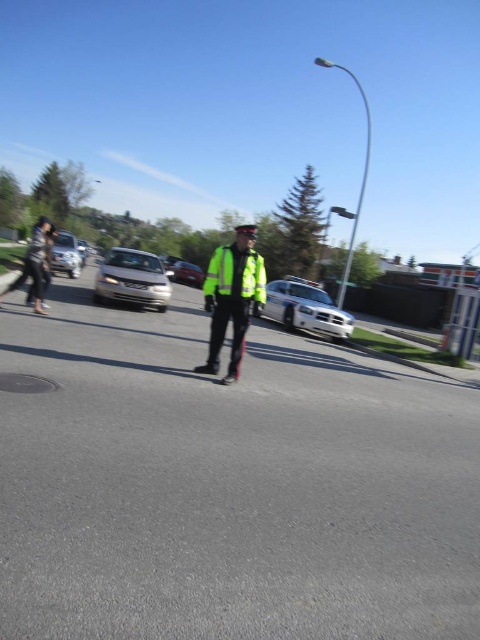
Question: Which point appears farthest from the camera in this image?

Choices:
 (A) (282, 294)
 (B) (68, 256)

Answer: (B)

Question: Can you confirm if satin silver sedan at center is positioned below silver metallic sedan at left?

Choices:
 (A) yes
 (B) no

Answer: (B)

Question: Estimate the real-world distances between objects in this image. Which object is farther from the white glossy police car at center?

Choices:
 (A) high visibility reflective jacket at center
 (B) shiny silver sedan at center
 (C) high-visibility reflective safety vest at center

Answer: (B)

Question: Does silver metallic sedan at left appear on the left side of shiny silver sedan at center?

Choices:
 (A) no
 (B) yes

Answer: (B)

Question: Among these objects, which one is nearest to the camera?

Choices:
 (A) shiny silver sedan at center
 (B) high-visibility reflective safety vest at center

Answer: (B)

Question: In this image, where is high-visibility reflective safety vest at center located relative to silver metallic sedan at left?

Choices:
 (A) below
 (B) above

Answer: (A)